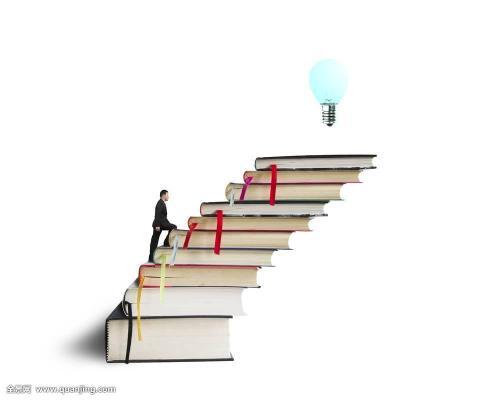
Find the location of a particular element. books is located at coordinates (329, 165), (326, 176), (321, 191), (305, 207), (301, 223), (280, 241), (246, 259), (230, 277), (211, 303), (191, 347).